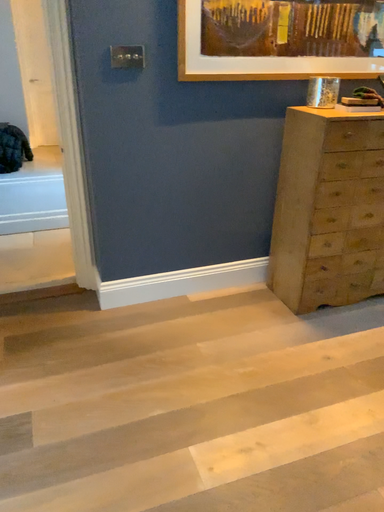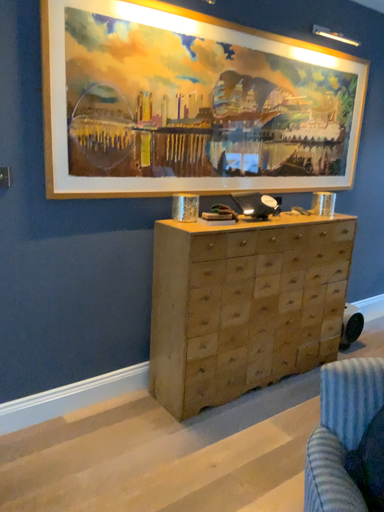
Question: Which way did the camera rotate in the video?

Choices:
 (A) rotated upward
 (B) rotated downward

Answer: (A)